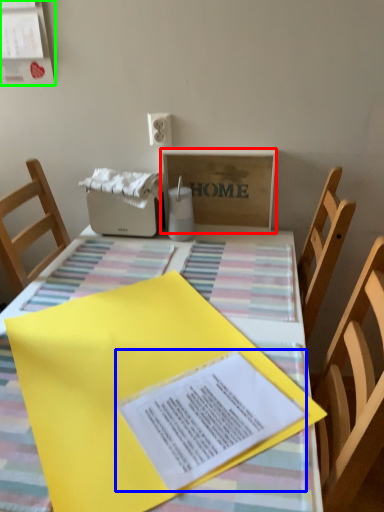
Question: Which object is positioned closest to cardboard box (highlighted by a red box)? Select from journal (highlighted by a blue box) and bulletin board (highlighted by a green box).

Choices:
 (A) journal
 (B) bulletin board

Answer: (B)